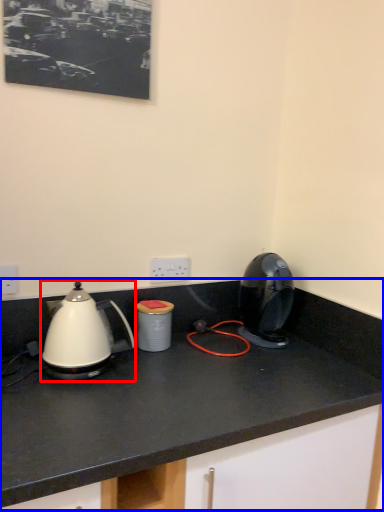
Question: Which object appears closest to the camera in this image, kettle (highlighted by a red box) or countertop (highlighted by a blue box)?

Choices:
 (A) kettle
 (B) countertop

Answer: (B)